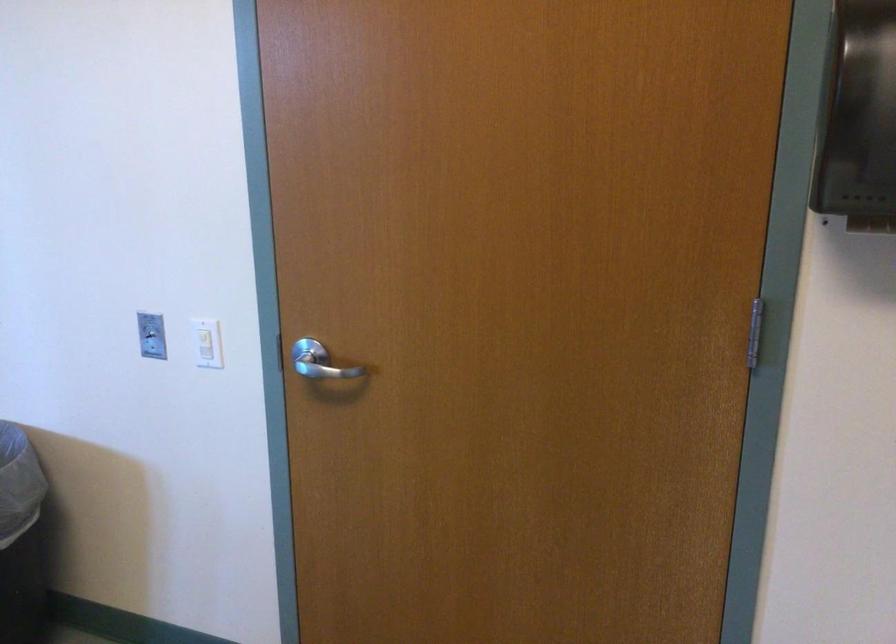
The image size is (896, 644). In order to click on keyed wall switch in this screenshot , I will do `click(151, 333)`.